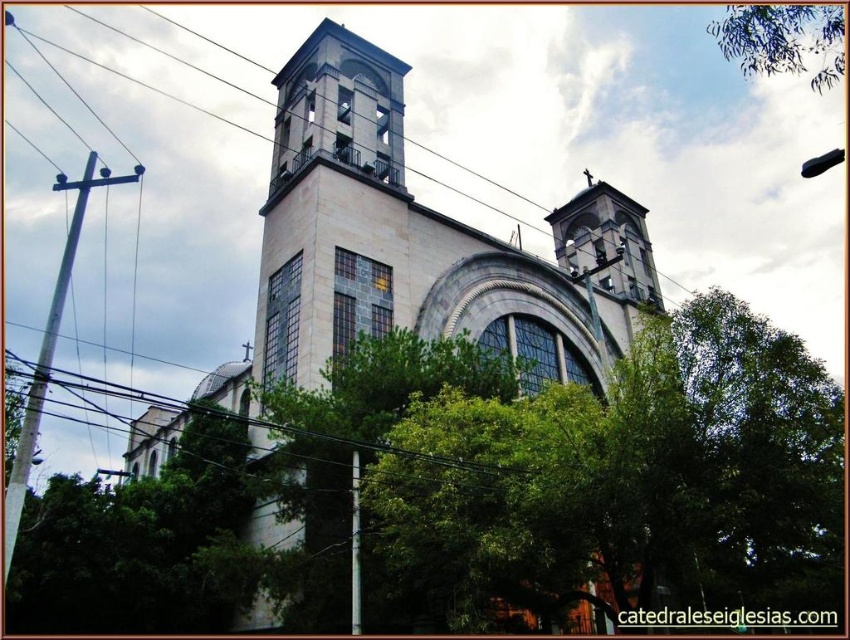
Question: Is white stone church at center positioned at the back of green leafy tree at upper center?

Choices:
 (A) no
 (B) yes

Answer: (A)

Question: Considering the relative positions of white stone church at center and green leafy tree at upper center in the image provided, where is white stone church at center located with respect to green leafy tree at upper center?

Choices:
 (A) right
 (B) left

Answer: (B)

Question: Which point is farther to the camera?

Choices:
 (A) green leafy tree at upper center
 (B) white stone church at center

Answer: (A)

Question: Which point appears farthest from the camera in this image?

Choices:
 (A) (511, 252)
 (B) (756, 22)

Answer: (A)

Question: Can you confirm if white stone church at center is positioned to the left of green leafy tree at upper center?

Choices:
 (A) yes
 (B) no

Answer: (A)